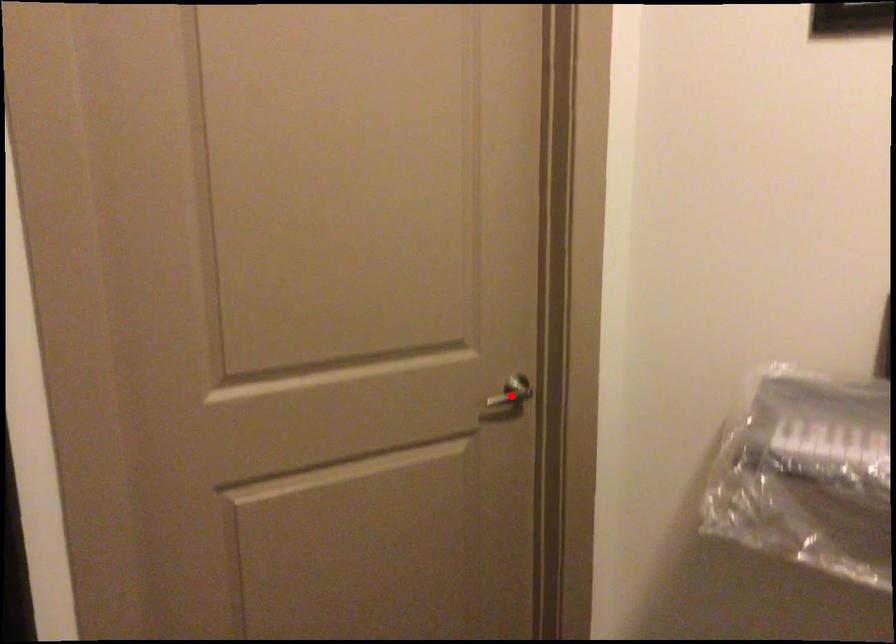
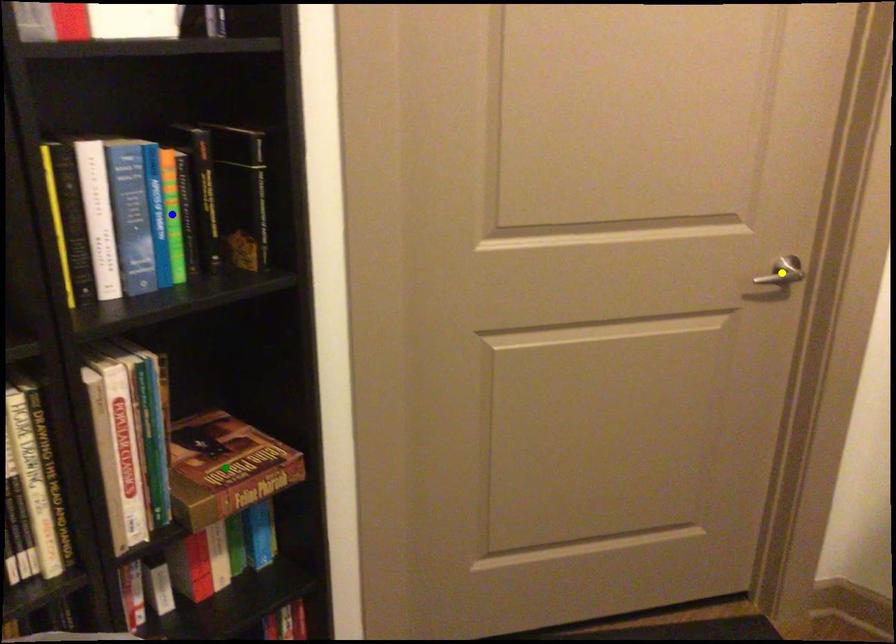
Question: I am providing you with two images of the same scene from different viewpoints. A red point is marked on the first image. You are given multiple points on the second image. Which point in image 2 is actually the same real-world point as the red point in image 1?

Choices:
 (A) blue point
 (B) green point
 (C) yellow point

Answer: (C)